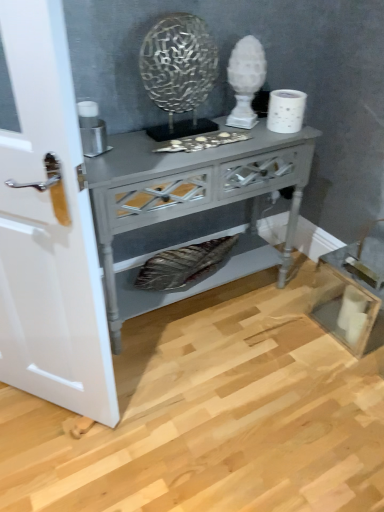
Find the location of `free space in front of white glossy door at left`. free space in front of white glossy door at left is located at coordinates (43, 460).